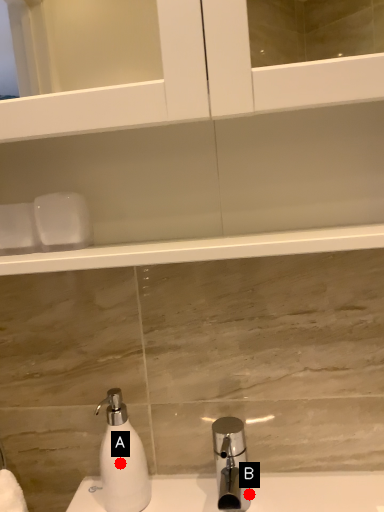
Question: Two points are circled on the image, labeled by A and B beside each circle. Which point is closer to the camera taking this photo?

Choices:
 (A) A is closer
 (B) B is closer

Answer: (A)